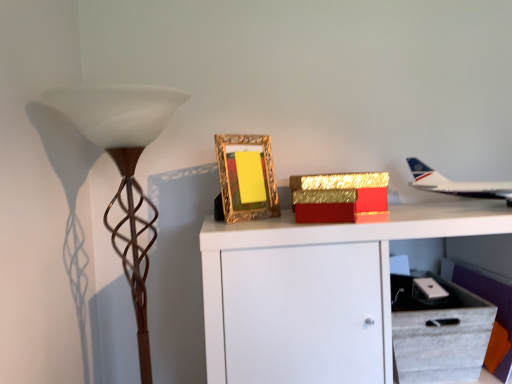
Find the location of `blank space situated above white fabric drawer at lower right (from a real-world perspective)`. blank space situated above white fabric drawer at lower right (from a real-world perspective) is located at coordinates (426, 291).